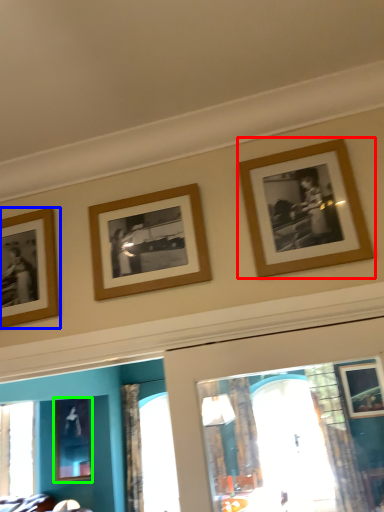
Question: Considering the real-world distances, which object is closest to picture frame (highlighted by a red box)? picture frame (highlighted by a blue box) or picture frame (highlighted by a green box).

Choices:
 (A) picture frame
 (B) picture frame

Answer: (A)